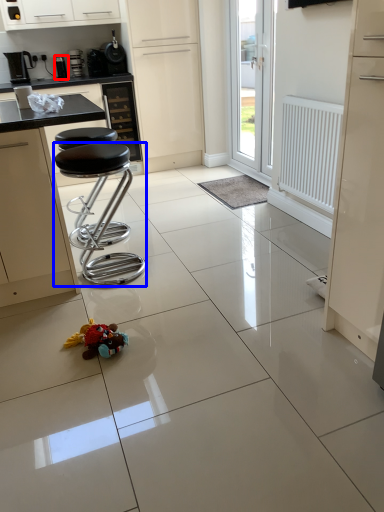
Question: Among these objects, which one is farthest to the camera, appliance (highlighted by a red box) or stool (highlighted by a blue box)?

Choices:
 (A) appliance
 (B) stool

Answer: (A)